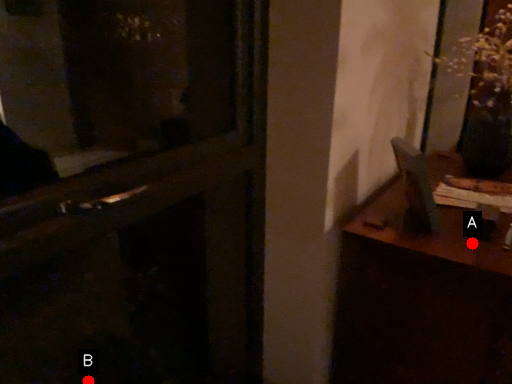
Question: Two points are circled on the image, labeled by A and B beside each circle. Which of the following is the closest to the observer?

Choices:
 (A) A is closer
 (B) B is closer

Answer: (B)